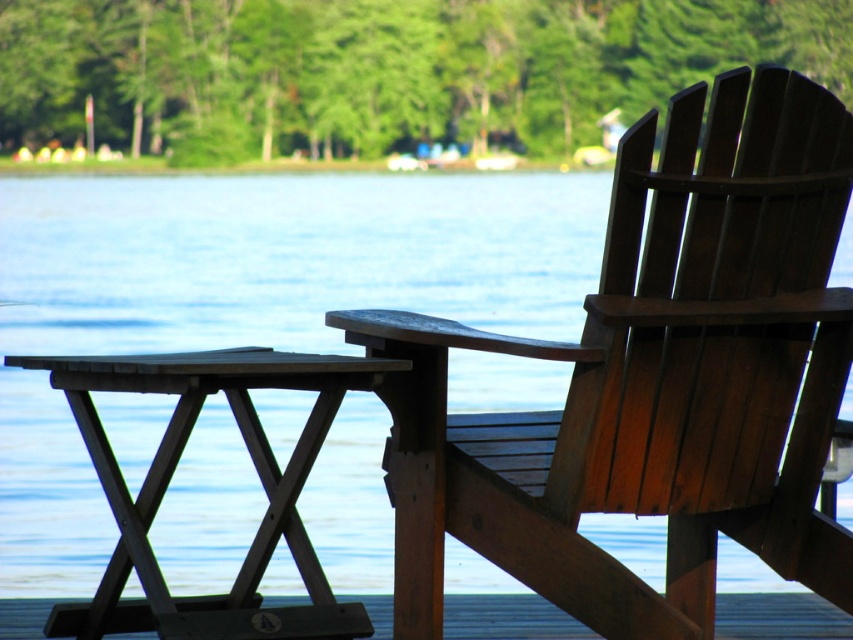
Can you confirm if wooden picnic table at lower left is positioned below wooden deck at lower center?

Incorrect, wooden picnic table at lower left is not positioned below wooden deck at lower center.

Does point (212, 598) come closer to viewer compared to point (787, 618)?

Yes, it is.

Where is `wooden picnic table at lower left`? This screenshot has height=640, width=853. wooden picnic table at lower left is located at coordinates (173, 472).

Who is more forward, [782,99] or [315,611]?

Point [782,99]

Does wooden chair at right appear on the right side of wooden picnic table at lower left?

Correct, you'll find wooden chair at right to the right of wooden picnic table at lower left.

Does point (815, 368) come behind point (120, 490)?

Yes, point (815, 368) is farther from viewer.

Image resolution: width=853 pixels, height=640 pixels. Identify the location of wooden chair at right. click(653, 380).

Who is more distant from viewer, (799, 182) or (490, 636)?

Positioned behind is point (490, 636).

Is wooden chair at right further to camera compared to wooden deck at lower center?

No, wooden chair at right is closer to the viewer.

What do you see at coordinates (653, 380) in the screenshot? I see `wooden chair at right` at bounding box center [653, 380].

Where is `wooden chair at right`? wooden chair at right is located at coordinates (653, 380).